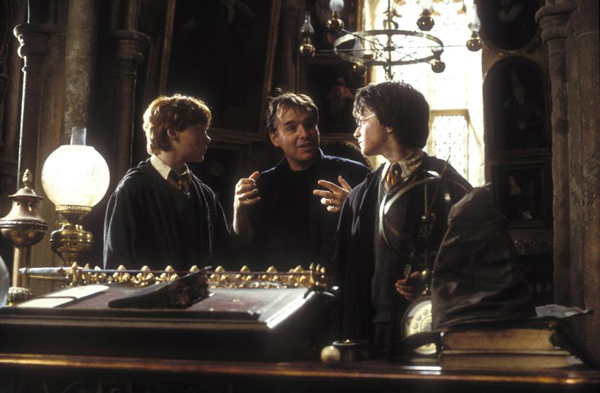
Locate an element on the screen. This screenshot has height=393, width=600. lamp is located at coordinates (73, 173).